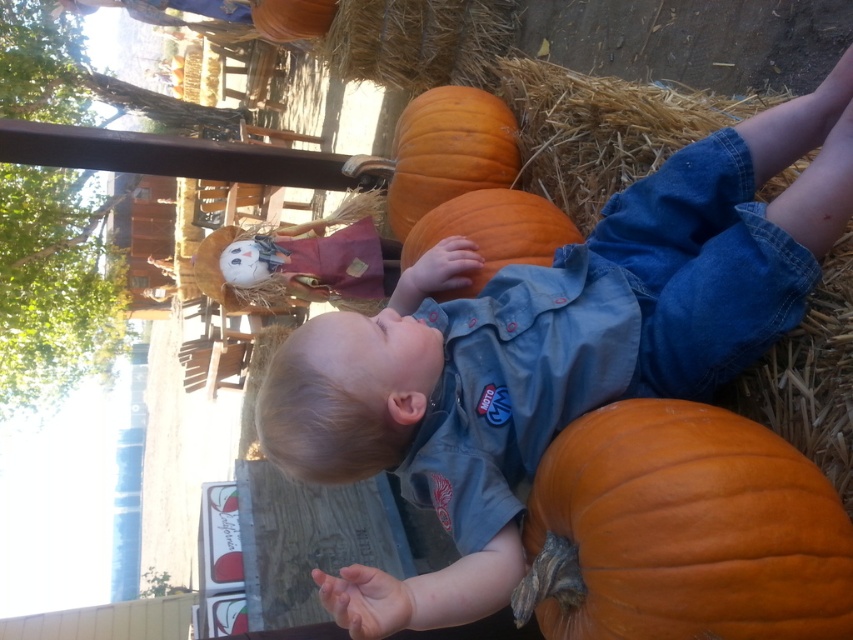
Question: Where is orange matte pumpkin at upper center located in relation to orange matte pumpkin at center in the image?

Choices:
 (A) below
 (B) above

Answer: (B)

Question: Is smooth denim shirt at center thinner than orange matte pumpkin at center?

Choices:
 (A) yes
 (B) no

Answer: (B)

Question: Which point is farther to the camera?

Choices:
 (A) (450, 214)
 (B) (469, 99)

Answer: (B)

Question: Does smooth denim shirt at center appear on the left side of orange matte pumpkin at upper center?

Choices:
 (A) no
 (B) yes

Answer: (A)

Question: Which object is the farthest from the orange matte pumpkin at lower right?

Choices:
 (A) orange matte pumpkin at center
 (B) smooth denim shirt at center
 (C) orange matte pumpkin at upper center

Answer: (C)

Question: Which object is farther from the camera taking this photo?

Choices:
 (A) smooth denim shirt at center
 (B) orange matte pumpkin at center
 (C) orange matte pumpkin at upper center

Answer: (C)